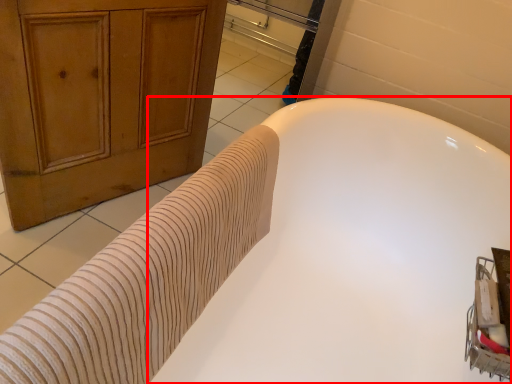
Question: From the image, what is the correct spatial relationship of bathtub (annotated by the red box) in relation to bath towel?

Choices:
 (A) left
 (B) right

Answer: (B)